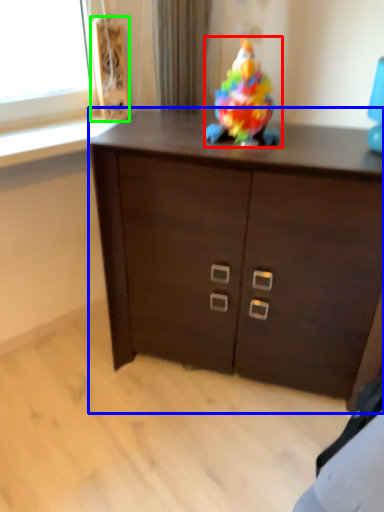
Question: Which object is positioned farthest from toy (highlighted by a red box)? Select from chest of drawers (highlighted by a blue box) and speaker (highlighted by a green box).

Choices:
 (A) chest of drawers
 (B) speaker

Answer: (B)